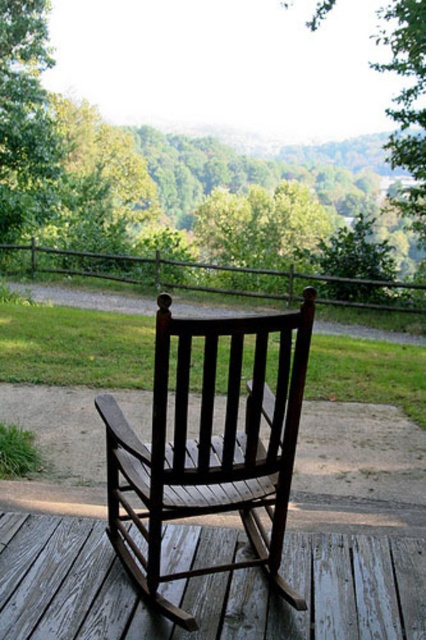
Question: Among these points, which one is nearest to the camera?

Choices:
 (A) (276, 556)
 (B) (405, 209)
 (C) (45, 592)
 (D) (51, 116)

Answer: (C)

Question: Can you confirm if green leafy tree at upper center is positioned to the right of green leafy tree at upper left?

Choices:
 (A) no
 (B) yes

Answer: (B)

Question: Can you confirm if green leafy tree at upper center is positioned below wooden deck at center?

Choices:
 (A) yes
 (B) no

Answer: (B)

Question: Does dark brown wood rocking chair at center have a smaller size compared to green leafy tree at upper left?

Choices:
 (A) yes
 (B) no

Answer: (B)

Question: Which of the following is the closest to the observer?

Choices:
 (A) (367, 624)
 (B) (253, 532)
 (C) (37, 182)
 (D) (388, 141)

Answer: (A)

Question: Among these objects, which one is nearest to the camera?

Choices:
 (A) dark brown wood rocking chair at center
 (B) wooden deck at center
 (C) green leafy tree at upper center
 (D) green leafy tree at upper left

Answer: (A)